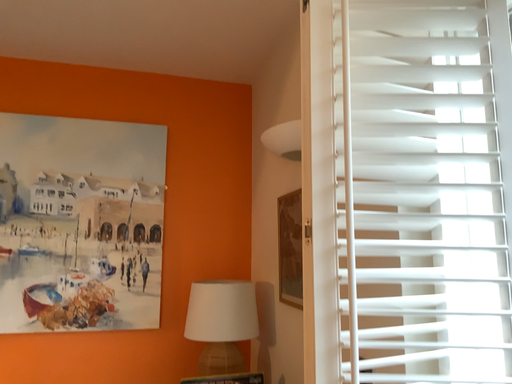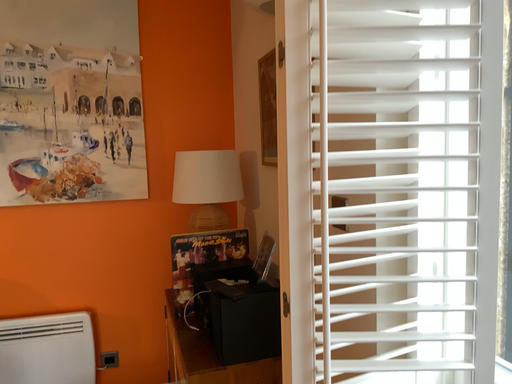
Question: How did the camera likely rotate when shooting the video?

Choices:
 (A) rotated upward
 (B) rotated downward

Answer: (B)